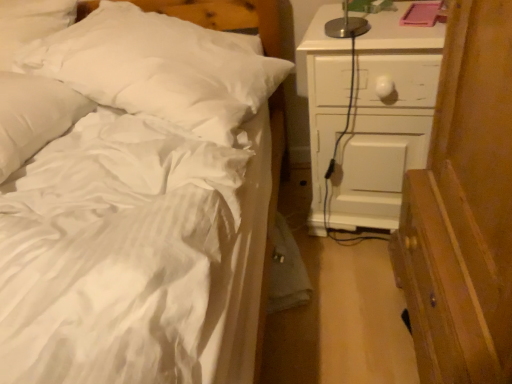
Question: Considering the relative positions of white painted wood chest of drawers at right and white soft pillow at upper left, the first pillow viewed from the right, in the image provided, is white painted wood chest of drawers at right behind white soft pillow at upper left, the first pillow viewed from the right,?

Choices:
 (A) no
 (B) yes

Answer: (B)

Question: Is white painted wood chest of drawers at right oriented away from white soft pillow at upper left, acting as the second pillow starting from the left?

Choices:
 (A) yes
 (B) no

Answer: (B)

Question: Are white painted wood chest of drawers at right and white soft pillow at upper left, acting as the second pillow starting from the left, far apart?

Choices:
 (A) yes
 (B) no

Answer: (B)

Question: Can you confirm if white painted wood chest of drawers at right is wider than white soft pillow at upper left, the first pillow viewed from the right?

Choices:
 (A) no
 (B) yes

Answer: (A)

Question: Considering the relative positions of white painted wood chest of drawers at right and white soft pillow at upper left, the first pillow viewed from the right, in the image provided, is white painted wood chest of drawers at right in front of white soft pillow at upper left, the first pillow viewed from the right,?

Choices:
 (A) no
 (B) yes

Answer: (A)

Question: From a real-world perspective, does white painted wood chest of drawers at right sit lower than white soft pillow at upper left, acting as the second pillow starting from the left?

Choices:
 (A) no
 (B) yes

Answer: (B)

Question: Can you confirm if white soft pillow at upper left, marked as the 1th pillow in a left-to-right arrangement, is thinner than white soft pillow at upper left, acting as the second pillow starting from the left?

Choices:
 (A) yes
 (B) no

Answer: (A)

Question: Is white soft pillow at upper left, marked as the 1th pillow in a left-to-right arrangement, at the left side of white soft pillow at upper left, acting as the second pillow starting from the left?

Choices:
 (A) no
 (B) yes

Answer: (B)

Question: Is white soft pillow at upper left, which is counted as the second pillow, starting from the right, aimed at white soft pillow at upper left, the first pillow viewed from the right?

Choices:
 (A) yes
 (B) no

Answer: (B)

Question: Does white soft pillow at upper left, marked as the 1th pillow in a left-to-right arrangement, have a lesser height compared to white soft pillow at upper left, acting as the second pillow starting from the left?

Choices:
 (A) yes
 (B) no

Answer: (A)

Question: Can you confirm if white soft pillow at upper left, which is counted as the second pillow, starting from the right, is taller than white soft pillow at upper left, the first pillow viewed from the right?

Choices:
 (A) yes
 (B) no

Answer: (B)

Question: Would you say white soft pillow at upper left, marked as the 1th pillow in a left-to-right arrangement, is outside white soft pillow at upper left, acting as the second pillow starting from the left?

Choices:
 (A) yes
 (B) no

Answer: (A)

Question: Is white soft pillow at upper left, marked as the 1th pillow in a left-to-right arrangement, oriented away from white painted wood chest of drawers at right?

Choices:
 (A) yes
 (B) no

Answer: (B)